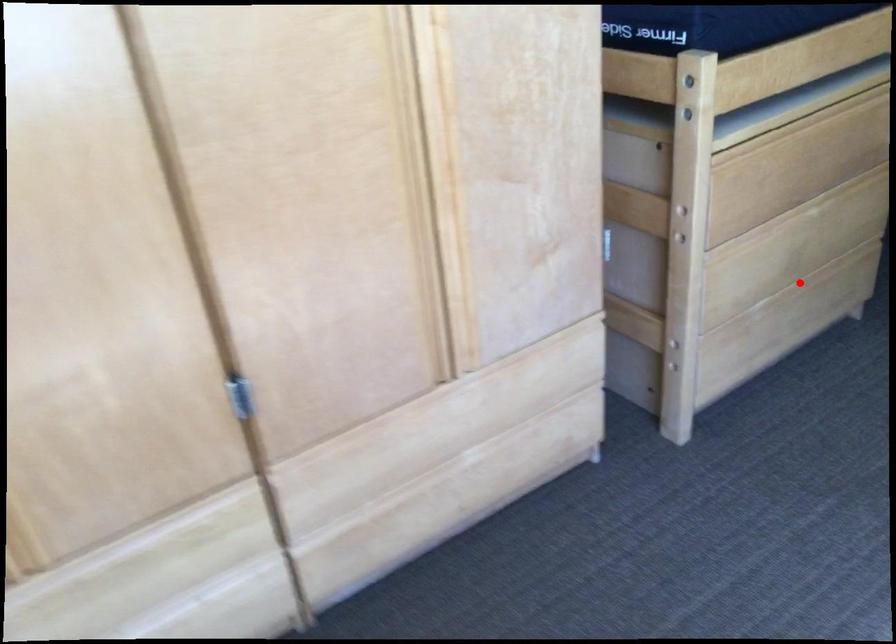
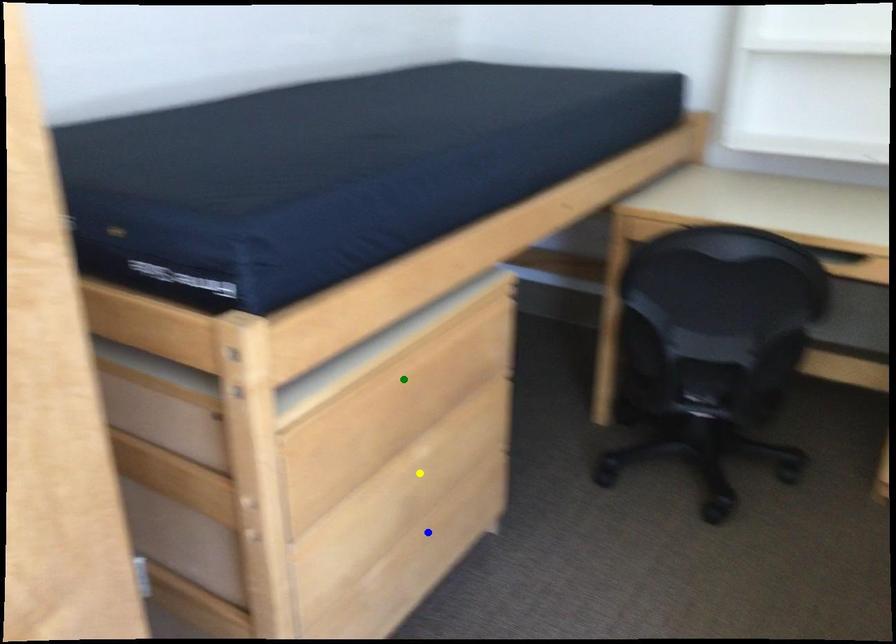
Question: I am providing you with two images of the same scene from different viewpoints. A red point is marked on the first image. You are given multiple points on the second image. Which mark in image 2 goes with the point in image 1?

Choices:
 (A) blue point
 (B) green point
 (C) yellow point

Answer: (A)